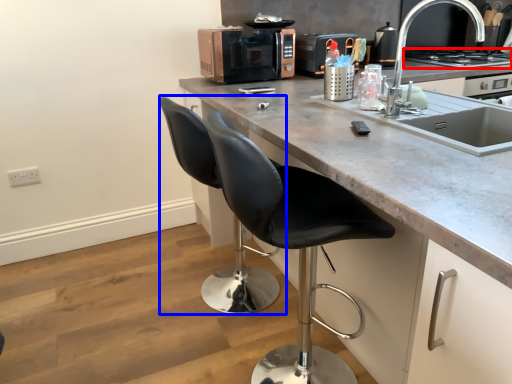
Question: Among these objects, which one is farthest to the camera, home appliance (highlighted by a red box) or swivel chair (highlighted by a blue box)?

Choices:
 (A) home appliance
 (B) swivel chair

Answer: (A)